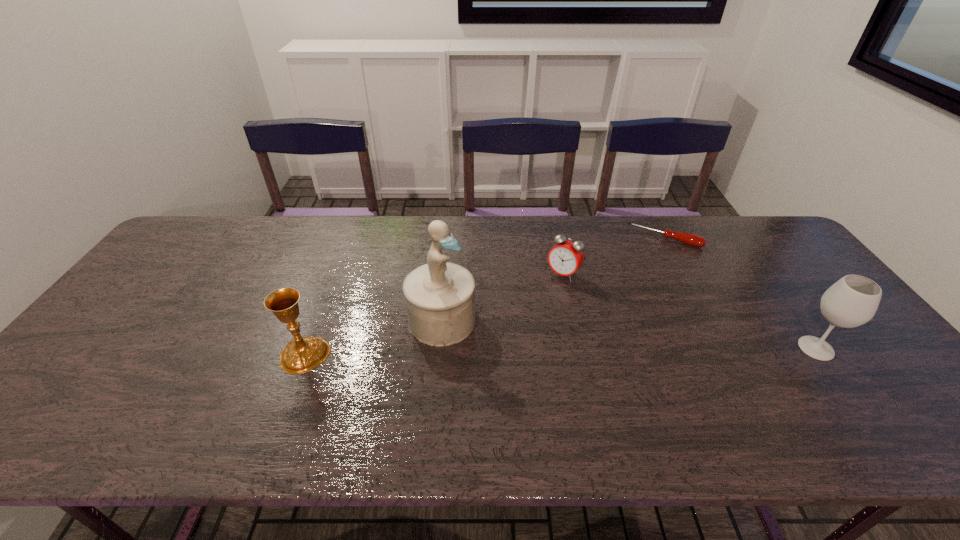
The width and height of the screenshot is (960, 540). Find the location of `object that is at the right edge`. object that is at the right edge is located at coordinates (852, 301).

The width and height of the screenshot is (960, 540). In order to click on blank area at the far edge in this screenshot , I will do `click(379, 246)`.

In the image, there is a desktop. Identify the location of vacant space at the near edge. (171, 402).

This screenshot has height=540, width=960. Identify the location of free space at the left edge of the desktop. (120, 326).

In the image, there is a desktop. At what (x,y) coordinates should I click in order to perform the action: click on blank space at the right edge. Please return your answer as a coordinate pair (x, y). Image resolution: width=960 pixels, height=540 pixels. Looking at the image, I should click on (826, 288).

Find the location of `free region at the far right corner`. free region at the far right corner is located at coordinates (749, 251).

Where is `vacant region at the near right corner of the desktop`? The image size is (960, 540). vacant region at the near right corner of the desktop is located at coordinates (899, 396).

At what (x,y) coordinates should I click in order to perform the action: click on free space that is in between the second farthest object and the shortest object. Please return your answer as a coordinate pair (x, y). The image size is (960, 540). Looking at the image, I should click on (613, 256).

Identify the location of free space between the second farthest object and the shortest object. The width and height of the screenshot is (960, 540). (613, 256).

This screenshot has width=960, height=540. I want to click on free space between the farthest object and the third object from left to right, so click(x=613, y=256).